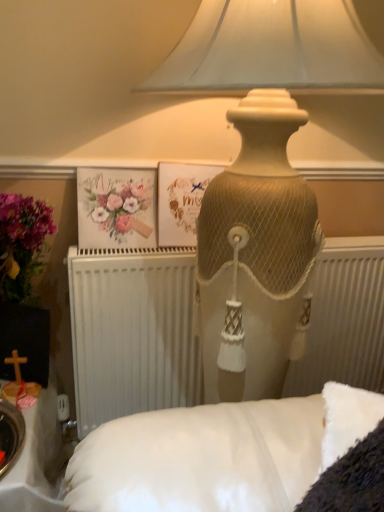
Describe the element at coordinates (132, 332) in the screenshot. The width and height of the screenshot is (384, 512). I see `white textured radiator at center` at that location.

Find the location of a particular element. The height and width of the screenshot is (512, 384). matte beige lamp at upper center is located at coordinates (271, 68).

What is the approximate height of matte beige lamp at upper center?

1.35 meters.

At what (x,y) coordinates should I click in order to perform the action: click on white textured radiator at center. Please return your answer as a coordinate pair (x, y). Looking at the image, I should click on click(x=132, y=332).

Is matte paper postcard at center positioned far away from white textured radiator at center?

matte paper postcard at center is near white textured radiator at center, not far away.

Considering the sizes of objects matte paper postcard at center and white textured radiator at center in the image provided, who is wider, matte paper postcard at center or white textured radiator at center?

With larger width is white textured radiator at center.

Is white textured radiator at center surrounded by matte paper postcard at center?

No, matte paper postcard at center does not contain white textured radiator at center.

Measure the distance from matte paper postcard at center to white textured radiator at center.

matte paper postcard at center and white textured radiator at center are 9.09 inches apart.

Considering the relative positions of watercolor paper flowers at upper left and matte beige lamp at upper center in the image provided, is watercolor paper flowers at upper left to the right of matte beige lamp at upper center from the viewer's perspective?

No.

Would you consider watercolor paper flowers at upper left to be distant from matte beige lamp at upper center?

No, watercolor paper flowers at upper left is not far away from matte beige lamp at upper center.

Considering the relative sizes of watercolor paper flowers at upper left and matte beige lamp at upper center in the image provided, is watercolor paper flowers at upper left shorter than matte beige lamp at upper center?

Yes.

Considering the relative sizes of watercolor paper flowers at upper left and matte beige lamp at upper center in the image provided, is watercolor paper flowers at upper left wider than matte beige lamp at upper center?

No, watercolor paper flowers at upper left is not wider than matte beige lamp at upper center.

Is watercolor paper flowers at upper left aimed at white textured radiator at center?

No, watercolor paper flowers at upper left is not facing towards white textured radiator at center.

Consider the image. Would you say watercolor paper flowers at upper left is to the left or to the right of white textured radiator at center in the picture?

In the image, watercolor paper flowers at upper left appears on the left side of white textured radiator at center.

Which object is more forward, watercolor paper flowers at upper left or white textured radiator at center?

white textured radiator at center.

Which of these two, matte paper postcard at center or matte beige lamp at upper center, is bigger?

Bigger between the two is matte beige lamp at upper center.

From a real-world perspective, which is physically above, matte paper postcard at center or matte beige lamp at upper center?

matte paper postcard at center, from a real-world perspective.

Who is shorter, matte paper postcard at center or matte beige lamp at upper center?

matte paper postcard at center.

Between white textured radiator at center and watercolor paper flowers at upper left, which one is positioned behind?

watercolor paper flowers at upper left is more distant.

Is white textured radiator at center looking in the opposite direction of watercolor paper flowers at upper left?

No, white textured radiator at center is not facing away from watercolor paper flowers at upper left.

Who is bigger, white textured radiator at center or watercolor paper flowers at upper left?

white textured radiator at center.

Does point (337, 355) appear closer or farther from the camera than point (120, 221)?

Point (337, 355) is farther from the camera than point (120, 221).

Is white textured radiator at center facing towards matte paper postcard at center?

No, white textured radiator at center does not turn towards matte paper postcard at center.

Considering the sizes of objects white textured radiator at center and matte paper postcard at center in the image provided, who is shorter, white textured radiator at center or matte paper postcard at center?

With less height is matte paper postcard at center.

Between white textured radiator at center and matte paper postcard at center, which one has smaller width?

Thinner between the two is matte paper postcard at center.

From the image's perspective, between white textured radiator at center and matte paper postcard at center, who is located below?

From the image's view, white textured radiator at center is below.

Which object is thinner, watercolor paper flowers at upper left or matte paper postcard at center?

With smaller width is watercolor paper flowers at upper left.

From the image's perspective, between watercolor paper flowers at upper left and matte paper postcard at center, which one is located above?

matte paper postcard at center, from the image's perspective.

Looking at this image, between watercolor paper flowers at upper left and matte paper postcard at center, which one has more height?

matte paper postcard at center.

Is the surface of watercolor paper flowers at upper left in direct contact with matte paper postcard at center?

No, watercolor paper flowers at upper left is not in contact with matte paper postcard at center.

At what (x,y) coordinates should I click in order to perform the action: click on radiator located underneath the matte paper postcard at center (from a real-world perspective). Please return your answer as a coordinate pair (x, y). This screenshot has height=512, width=384. Looking at the image, I should click on click(132, 332).

Locate an element on the screen. This screenshot has height=512, width=384. lamp in front of the watercolor paper flowers at upper left is located at coordinates (271, 68).

Which object lies nearer to the anchor point watercolor paper flowers at upper left, white textured radiator at center or matte beige lamp at upper center?

white textured radiator at center is closer to watercolor paper flowers at upper left.

Considering their positions, is watercolor paper flowers at upper left positioned further to matte paper postcard at center than white textured radiator at center?

white textured radiator at center.

Considering their positions, is matte beige lamp at upper center positioned closer to matte paper postcard at center than watercolor paper flowers at upper left?

watercolor paper flowers at upper left.

From the image, which object appears to be nearer to white textured radiator at center, watercolor paper flowers at upper left or matte paper postcard at center?

The object closer to white textured radiator at center is matte paper postcard at center.

Estimate the real-world distances between objects in this image. Which object is further from watercolor paper flowers at upper left, white textured radiator at center or matte paper postcard at center?

white textured radiator at center is positioned further to the anchor watercolor paper flowers at upper left.

Looking at the image, which one is located further to white textured radiator at center, matte paper postcard at center or watercolor paper flowers at upper left?

watercolor paper flowers at upper left lies further to white textured radiator at center than the other object.

Considering their positions, is matte beige lamp at upper center positioned further to white textured radiator at center than watercolor paper flowers at upper left?

matte beige lamp at upper center.

When comparing their distances from watercolor paper flowers at upper left, does matte paper postcard at center or white textured radiator at center seem further?

white textured radiator at center.

The image size is (384, 512). I want to click on radiator between matte beige lamp at upper center and watercolor paper flowers at upper left in the front-back direction, so click(x=132, y=332).

Where is `flower between matte paper postcard at center and white textured radiator at center in the up-down direction`? The width and height of the screenshot is (384, 512). flower between matte paper postcard at center and white textured radiator at center in the up-down direction is located at coordinates (118, 205).

Where is `radiator positioned between matte beige lamp at upper center and matte paper postcard at center from near to far`? This screenshot has height=512, width=384. radiator positioned between matte beige lamp at upper center and matte paper postcard at center from near to far is located at coordinates (132, 332).

Locate an element on the screen. The width and height of the screenshot is (384, 512). flower between matte beige lamp at upper center and matte paper postcard at center in the front-back direction is located at coordinates (118, 205).